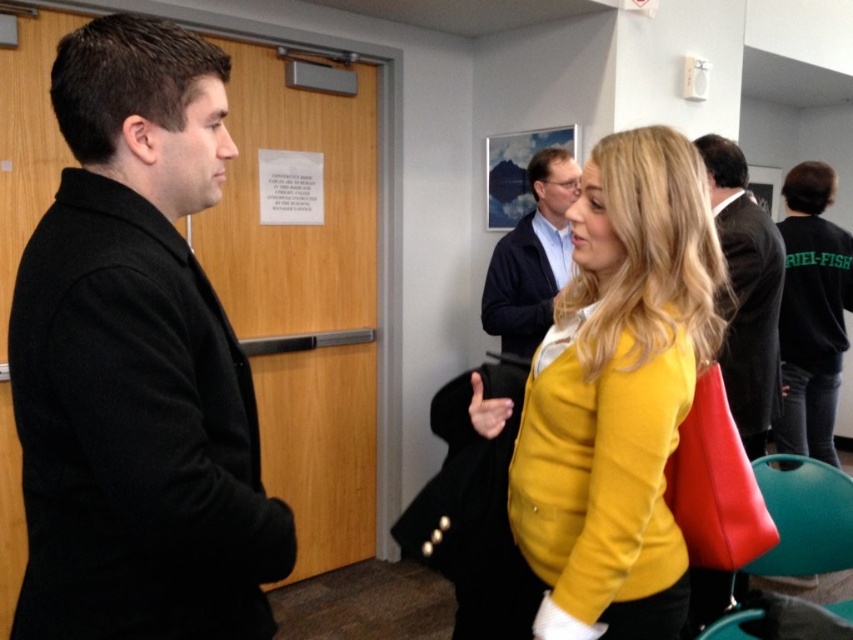
Is yellow matte jacket at center shorter than blue fabric jacket at center?

Incorrect, yellow matte jacket at center's height does not fall short of blue fabric jacket at center's.

Which is below, yellow matte jacket at center or blue fabric jacket at center?

yellow matte jacket at center

Describe the element at coordinates (618, 394) in the screenshot. I see `yellow matte jacket at center` at that location.

This screenshot has height=640, width=853. Identify the location of yellow matte jacket at center. (618, 394).

Which is in front, point (178, 429) or point (646, 484)?

Point (178, 429)

This screenshot has width=853, height=640. Find the location of `black wool coat at left`. black wool coat at left is located at coordinates (137, 364).

The image size is (853, 640). In order to click on black wool coat at left in this screenshot , I will do `click(137, 364)`.

Can you confirm if black wool coat at left is positioned to the right of dark gray suit at center?

In fact, black wool coat at left is to the left of dark gray suit at center.

Does black wool coat at left have a larger size compared to dark gray suit at center?

No, black wool coat at left is not bigger than dark gray suit at center.

Describe the element at coordinates (137, 364) in the screenshot. I see `black wool coat at left` at that location.

What are the coordinates of `black wool coat at left` in the screenshot? It's located at (137, 364).